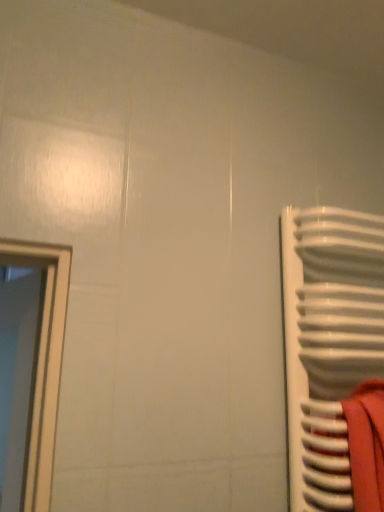
Question: Should I look upward or downward to see white glossy door at left?

Choices:
 (A) down
 (B) up

Answer: (A)

Question: Is white glossy radiator at right closer to camera compared to white glossy door at left?

Choices:
 (A) yes
 (B) no

Answer: (A)

Question: Could you tell me if white glossy radiator at right is facing white glossy door at left?

Choices:
 (A) yes
 (B) no

Answer: (B)

Question: Is white glossy radiator at right shorter than white glossy door at left?

Choices:
 (A) yes
 (B) no

Answer: (A)

Question: From a real-world perspective, is white glossy radiator at right physically above white glossy door at left?

Choices:
 (A) no
 (B) yes

Answer: (A)

Question: Is white glossy radiator at right turned away from white glossy door at left?

Choices:
 (A) yes
 (B) no

Answer: (B)

Question: Does white glossy radiator at right have a greater height compared to white glossy door at left?

Choices:
 (A) no
 (B) yes

Answer: (A)

Question: Is white glossy door at left oriented towards white glossy radiator at right?

Choices:
 (A) no
 (B) yes

Answer: (A)

Question: Is white glossy radiator at right completely or partially inside white glossy door at left?

Choices:
 (A) no
 (B) yes

Answer: (A)

Question: Can you confirm if white glossy door at left is thinner than white glossy radiator at right?

Choices:
 (A) yes
 (B) no

Answer: (A)

Question: From a real-world perspective, is white glossy door at left located beneath white glossy radiator at right?

Choices:
 (A) no
 (B) yes

Answer: (A)

Question: Is white glossy door at left shorter than white glossy radiator at right?

Choices:
 (A) no
 (B) yes

Answer: (A)

Question: Is white glossy door at left at the right side of white glossy radiator at right?

Choices:
 (A) yes
 (B) no

Answer: (B)

Question: Is white glossy door at left to the left or to the right of white glossy radiator at right in the image?

Choices:
 (A) left
 (B) right

Answer: (A)